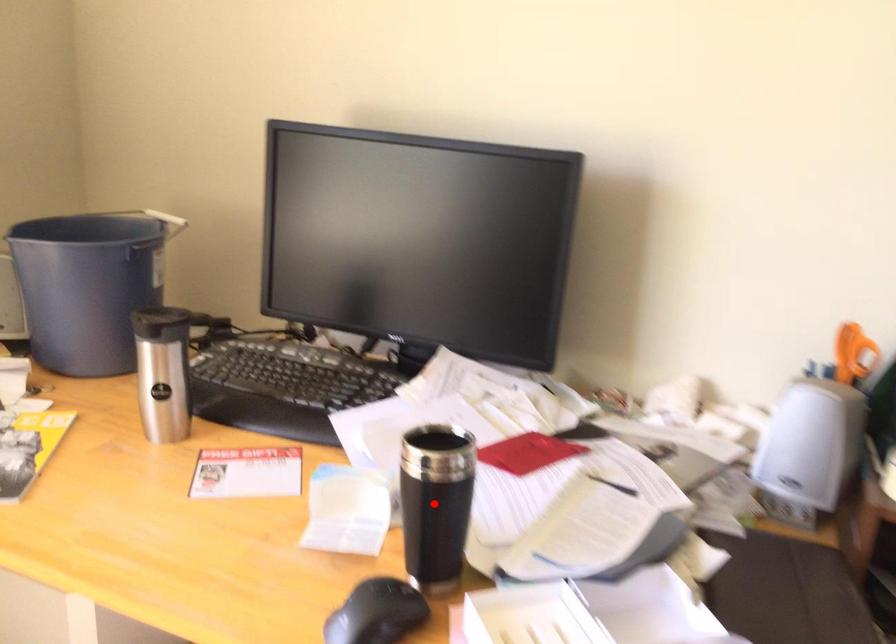
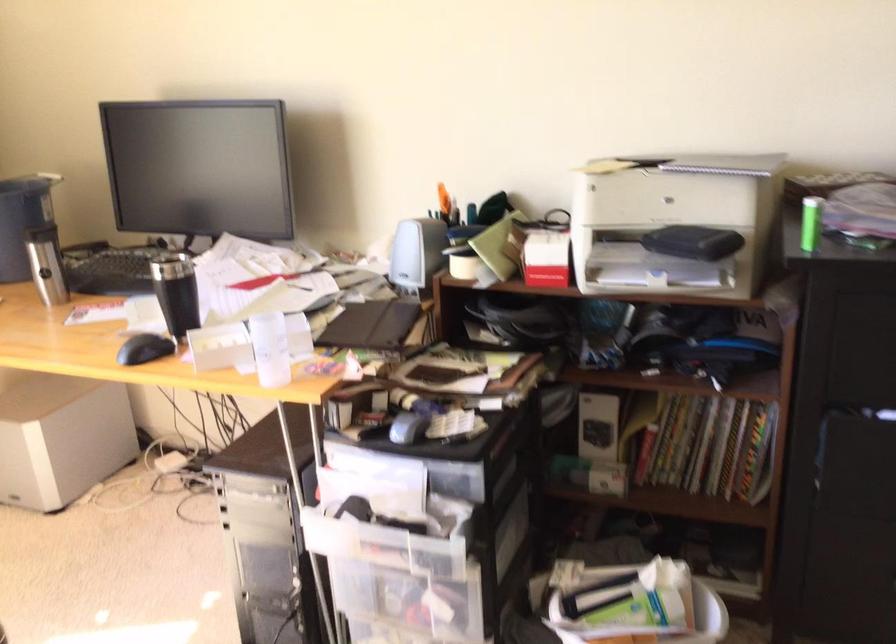
Locate, in the second image, the point that corresponds to the highlighted location in the first image.

(176, 292)